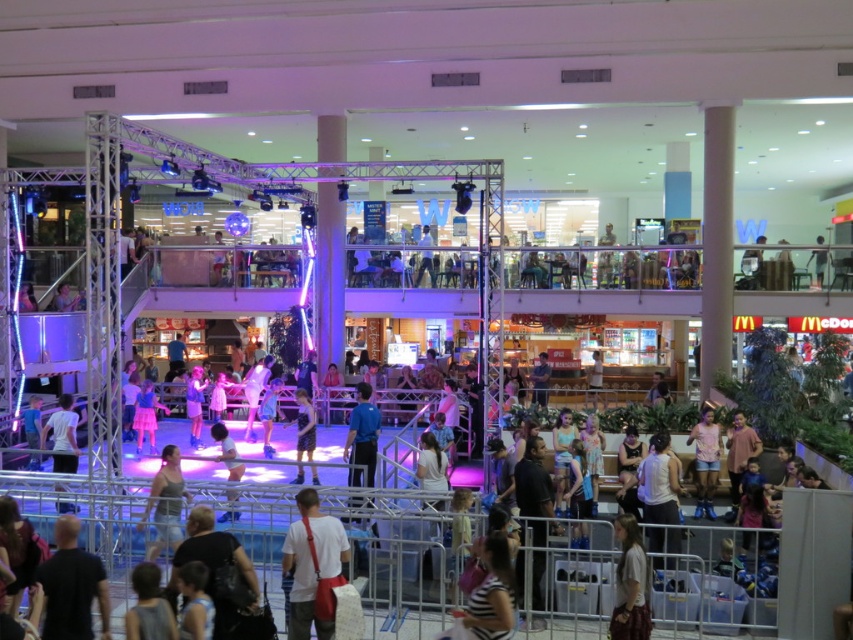
Question: Based on their relative distances, which object is farther from the white matte tank top at center?

Choices:
 (A) blue fabric shirt at center
 (B) denim jeans at center
 (C) pink cotton shirt at center

Answer: (B)

Question: Can you confirm if blue fabric shirt at center is positioned above white matte shirt at lower left?

Choices:
 (A) yes
 (B) no

Answer: (B)

Question: Which object appears closest to the camera in this image?

Choices:
 (A) denim jeans at center
 (B) white matte shirt at lower left
 (C) white matte tank top at center

Answer: (A)

Question: Is black matte shirt at lower left behind blue fabric shirt at center?

Choices:
 (A) yes
 (B) no

Answer: (B)

Question: Which object appears farthest from the camera in this image?

Choices:
 (A) dark gray fabric backpack at lower center
 (B) white matte tank top at center
 (C) blue fabric shirt at center
 (D) light brown fabric dress at lower right

Answer: (C)

Question: Does white fabric shirt at center appear on the right side of pink cotton shirt at center?

Choices:
 (A) yes
 (B) no

Answer: (B)